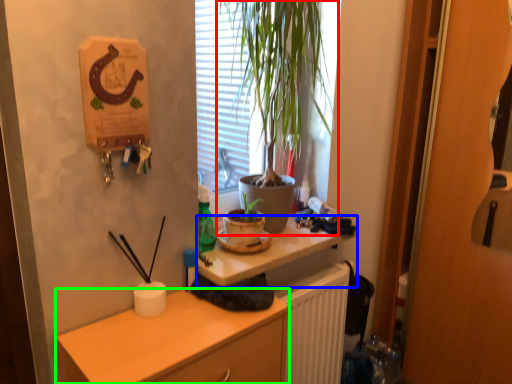
Question: Which object is positioned farthest from houseplant (highlighted by a red box)? Select from desk (highlighted by a blue box) and cabinetry (highlighted by a green box).

Choices:
 (A) desk
 (B) cabinetry

Answer: (B)